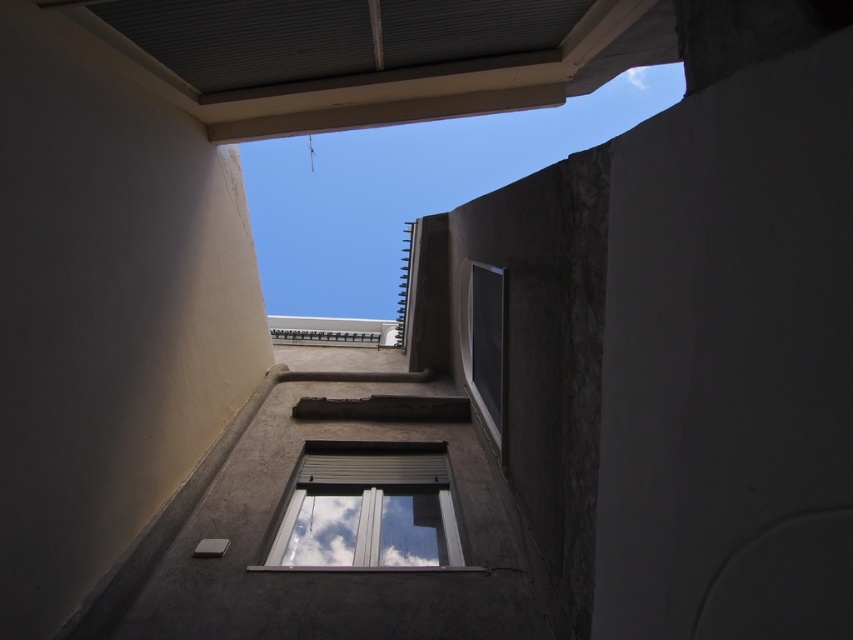
Question: Is white plastic window at center closer to the viewer compared to white fluffy cloud at upper center?

Choices:
 (A) no
 (B) yes

Answer: (B)

Question: Which of the following is the farthest from the observer?

Choices:
 (A) (299, 536)
 (B) (630, 83)

Answer: (B)

Question: Which object is positioned farthest from the white plastic window at center?

Choices:
 (A) matte glass window at center
 (B) white fluffy cloud at upper center

Answer: (B)

Question: Is the position of white plastic window at center less distant than that of white fluffy cloud at upper center?

Choices:
 (A) no
 (B) yes

Answer: (B)

Question: Which of the following is the closest to the observer?

Choices:
 (A) matte glass window at center
 (B) white fluffy cloud at upper center

Answer: (A)

Question: Is white plastic window at center to the left of white fluffy cloud at upper center from the viewer's perspective?

Choices:
 (A) yes
 (B) no

Answer: (A)